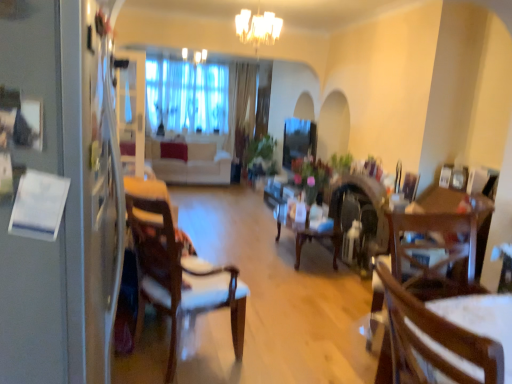
Question: Is transparent glass window screen at center taller than white glass chandelier at upper center?

Choices:
 (A) no
 (B) yes

Answer: (B)

Question: From the image's perspective, is transparent glass window screen at center beneath white glass chandelier at upper center?

Choices:
 (A) no
 (B) yes

Answer: (B)

Question: Does transparent glass window screen at center contain white glass chandelier at upper center?

Choices:
 (A) yes
 (B) no

Answer: (B)

Question: Does transparent glass window screen at center lie behind white glass chandelier at upper center?

Choices:
 (A) no
 (B) yes

Answer: (B)

Question: Is transparent glass window screen at center facing away from white glass chandelier at upper center?

Choices:
 (A) no
 (B) yes

Answer: (A)

Question: Is transparent glass window screen at center bigger than white glass chandelier at upper center?

Choices:
 (A) yes
 (B) no

Answer: (A)

Question: Would you say white glossy fridge at left contains wooden table at center?

Choices:
 (A) yes
 (B) no

Answer: (B)

Question: Is the surface of white glossy fridge at left in direct contact with wooden table at center?

Choices:
 (A) no
 (B) yes

Answer: (A)

Question: Does white glossy fridge at left have a larger size compared to wooden table at center?

Choices:
 (A) no
 (B) yes

Answer: (B)

Question: Can you confirm if white glossy fridge at left is shorter than wooden table at center?

Choices:
 (A) yes
 (B) no

Answer: (B)

Question: Can you confirm if white glossy fridge at left is taller than wooden table at center?

Choices:
 (A) no
 (B) yes

Answer: (B)

Question: Is the depth of white glossy fridge at left greater than that of wooden table at center?

Choices:
 (A) yes
 (B) no

Answer: (B)

Question: Is wooden table at center oriented towards white glossy fridge at left?

Choices:
 (A) yes
 (B) no

Answer: (B)